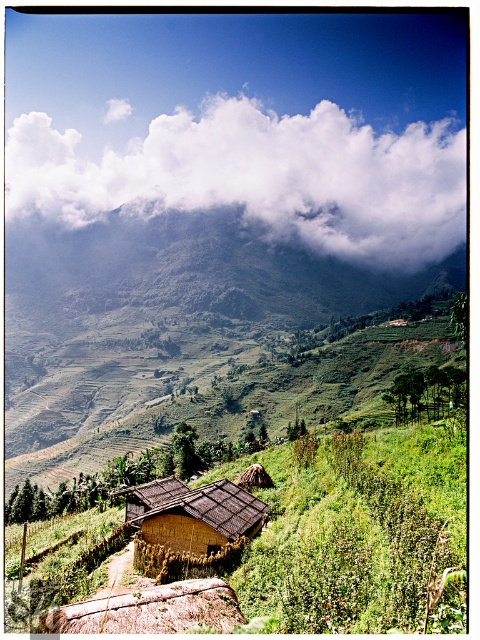
You are an airplane passenger looking out the window and see the white fluffy cloud at upper center and the green grassy mountain at upper center. Which one appears wider from your perspective?

The white fluffy cloud at upper center appears wider than the green grassy mountain at upper center because its width is larger than the mountain.

You are a drone operator trying to capture a photo of the white fluffy cloud at upper center. The drone has a GPS coordinate system where the bottom left corner is the origin point. The cloud is located at point A. What are the coordinates of point A?

The coordinates of point A where the white fluffy cloud at upper center is located are 0.278 on the x axis and 0.542 on the y axis.

You are standing at the point marked by the coordinates point (260, 177) in the image. Looking around, what object is directly above you?

The point (260, 177) corresponds to the white fluffy cloud at upper center, so the object directly above you would be the white fluffy cloud at upper center.